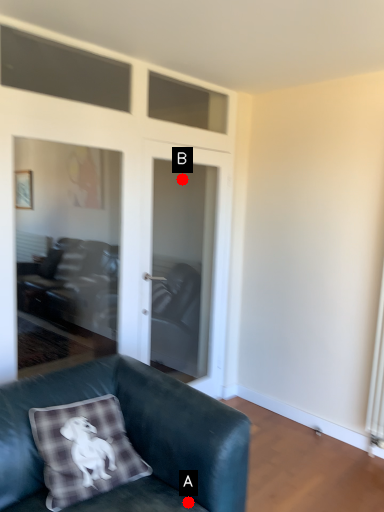
Question: Two points are circled on the image, labeled by A and B beside each circle. Which point is farther to the camera?

Choices:
 (A) A is further
 (B) B is further

Answer: (B)